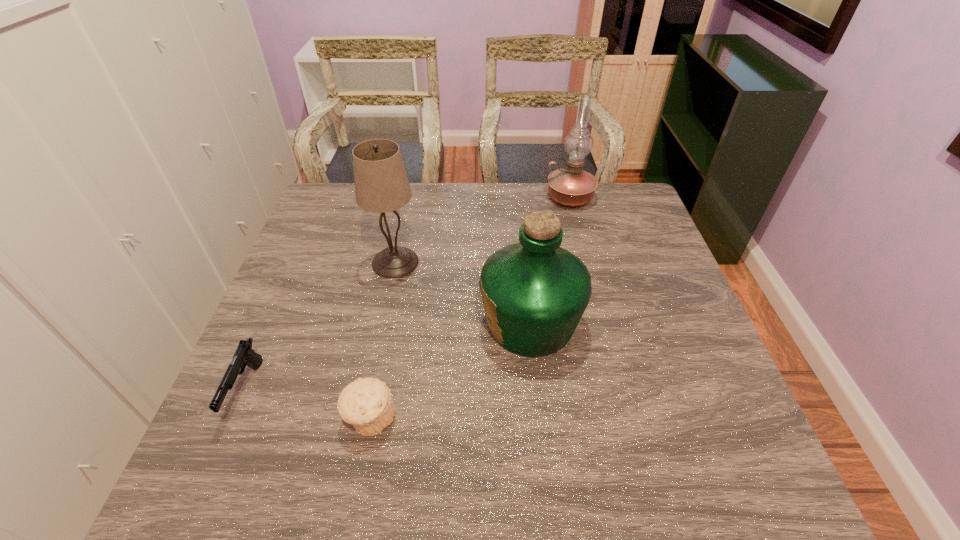
Where is `free space that is in between the second farthest object and the muffin`? This screenshot has width=960, height=540. free space that is in between the second farthest object and the muffin is located at coordinates (383, 340).

Find the location of a particular element. vacant area between the gun and the lampshade is located at coordinates (321, 327).

In order to click on empty space that is in between the muffin and the liquor in this screenshot , I will do `click(450, 371)`.

In order to click on free space between the farthest object and the muffin in this screenshot , I will do `click(470, 308)`.

You are a GUI agent. You are given a task and a screenshot of the screen. Output one action in this format:
    pyautogui.click(x=<x>, y=<y>)
    Task: Click on the vacant region between the muffin and the liquor
    This screenshot has height=540, width=960.
    Given the screenshot: What is the action you would take?
    pyautogui.click(x=450, y=371)

Find the location of a particular element. The height and width of the screenshot is (540, 960). unoccupied position between the leftmost object and the lampshade is located at coordinates (321, 327).

What are the coordinates of `vacant region between the gun and the liquor` in the screenshot? It's located at (388, 357).

Where is `blank region between the muffin and the second farthest object`? blank region between the muffin and the second farthest object is located at coordinates (383, 340).

This screenshot has height=540, width=960. Find the location of `object that is the nearest to the liquor`. object that is the nearest to the liquor is located at coordinates (381, 185).

Point out which object is positioned as the fourth nearest to the liquor. Please provide its 2D coordinates. Your answer should be formatted as a tuple, i.e. [(x, y)], where the tuple contains the x and y coordinates of a point satisfying the conditions above.

[(244, 355)]